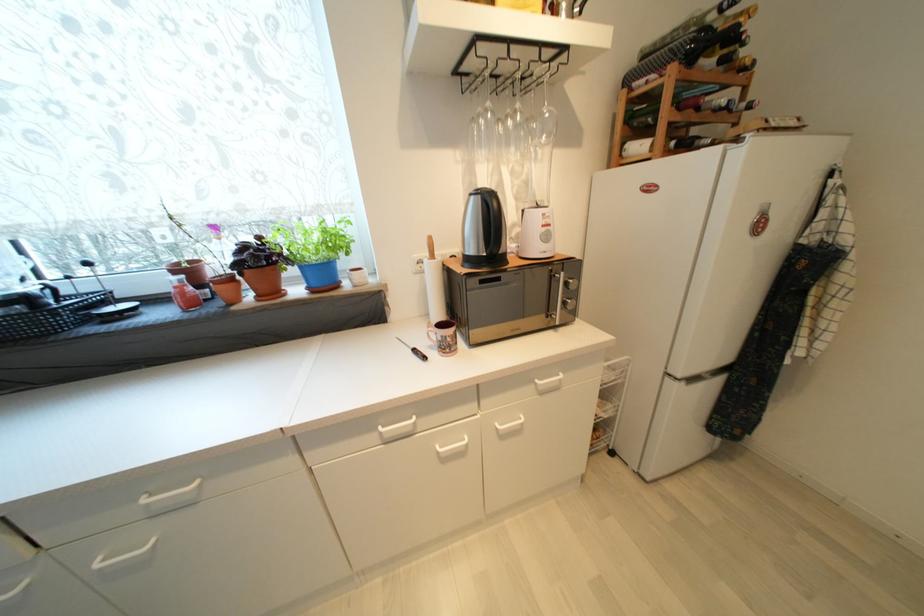
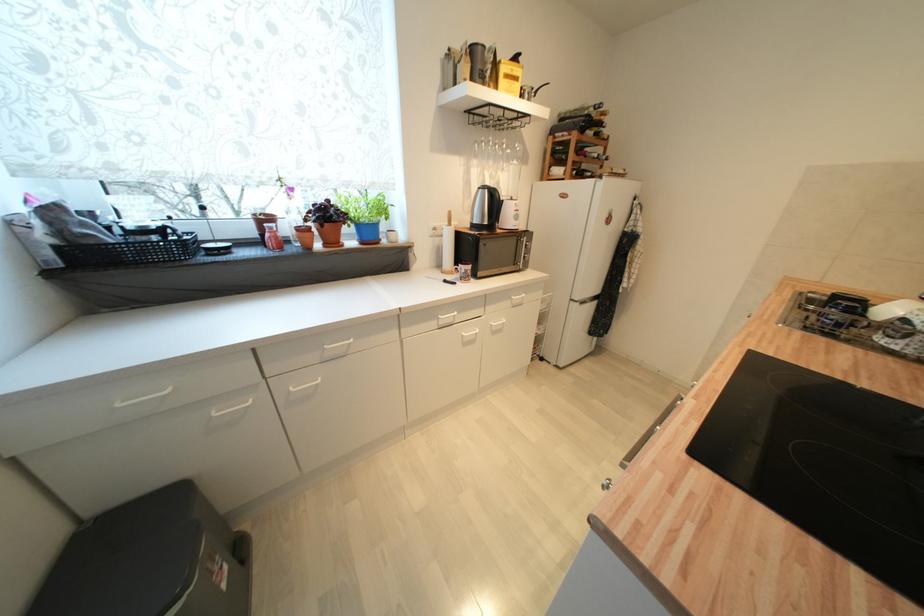
Locate, in the second image, the point that corresponds to (542,208) in the first image.

(517, 201)